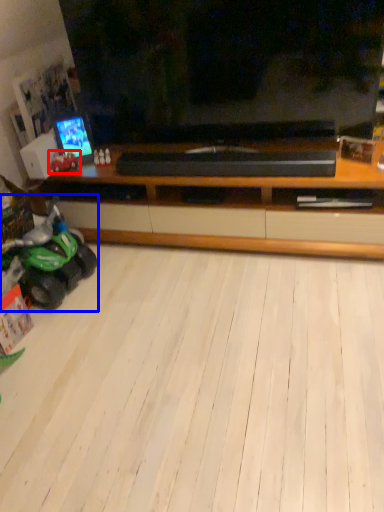
Question: Which point is further to the camera, land vehicle (highlighted by a red box) or land vehicle (highlighted by a blue box)?

Choices:
 (A) land vehicle
 (B) land vehicle

Answer: (A)